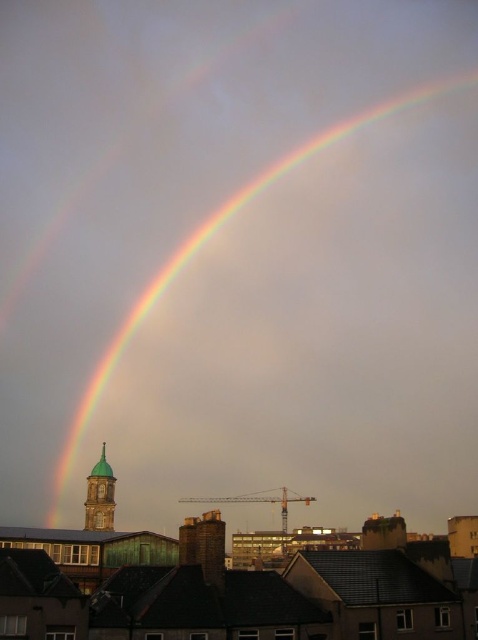
Can you confirm if rainbow at upper center is thinner than green matte bell tower at center?

No.

Can you confirm if rainbow at upper center is bigger than green matte bell tower at center?

Correct, rainbow at upper center is larger in size than green matte bell tower at center.

Between point (177, 260) and point (95, 512), which one is positioned behind?

The point (177, 260) is more distant.

Where is `rainbow at upper center`? This screenshot has width=478, height=640. rainbow at upper center is located at coordinates (209, 237).